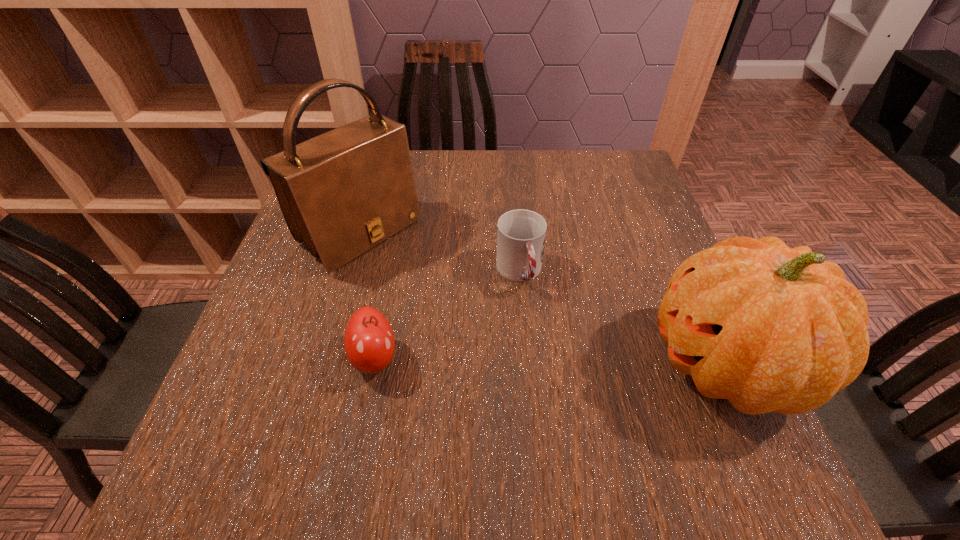
Identify the location of free space that satisfies the following two spatial constraints: 1. on the back side of the second object from right to left; 2. on the left side of the apple. (392, 272).

Locate an element on the screen. vacant position in the image that satisfies the following two spatial constraints: 1. on the front side of the pumpkin; 2. on the carved face of the apple is located at coordinates (373, 364).

The image size is (960, 540). I want to click on free spot that satisfies the following two spatial constraints: 1. on the back side of the apple; 2. on the right side of the second object from right to left, so click(x=392, y=272).